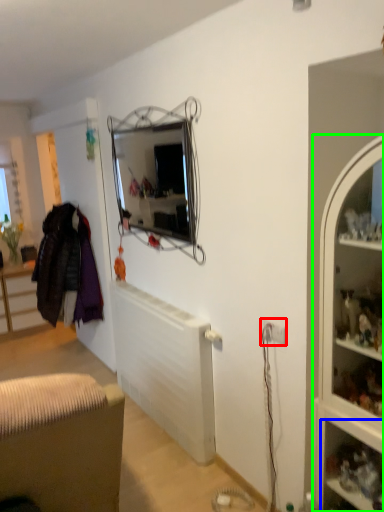
Question: Based on their relative distances, which object is nearer to electric outlet (highlighted by a red box)? Choose from shelf (highlighted by a blue box) and cabinet (highlighted by a green box).

Choices:
 (A) shelf
 (B) cabinet

Answer: (B)